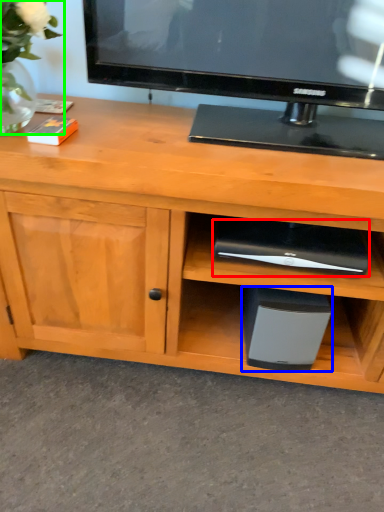
Question: Based on their relative distances, which object is nearer to appliance (highlighted by a red box)? Choose from appliance (highlighted by a blue box) and floral arrangement (highlighted by a green box).

Choices:
 (A) appliance
 (B) floral arrangement

Answer: (A)